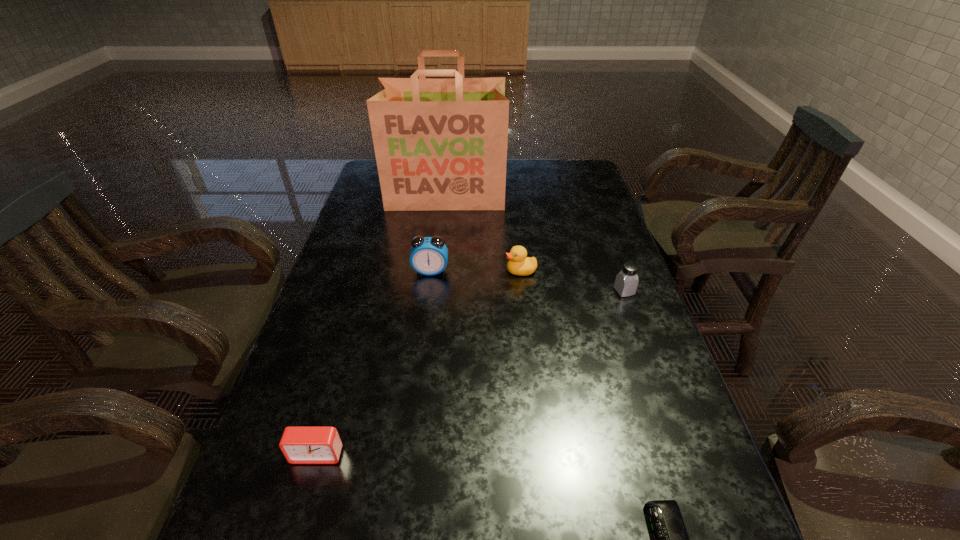
Find the location of a particular element. free point located 0.360m on the face of the fifth shortest object is located at coordinates (416, 385).

This screenshot has height=540, width=960. Find the location of `free location located on the back of the third nearest object`. free location located on the back of the third nearest object is located at coordinates (606, 239).

The image size is (960, 540). I want to click on vacant space located on the face of the duckling, so click(423, 271).

In order to click on free space located 0.270m on the face of the duckling in this screenshot , I will do `click(409, 271)`.

The height and width of the screenshot is (540, 960). Find the location of `vacant space located 0.370m on the face of the duckling`. vacant space located 0.370m on the face of the duckling is located at coordinates (373, 271).

At what (x,y) coordinates should I click in order to perform the action: click on object that is at the far edge. Please return your answer as a coordinate pair (x, y). Looking at the image, I should click on (440, 144).

The image size is (960, 540). What are the coordinates of `grocery bag that is at the left edge` in the screenshot? It's located at (440, 144).

You are a GUI agent. You are given a task and a screenshot of the screen. Output one action in this format:
    pyautogui.click(x=<x>, y=<y>)
    Task: Click on the alarm clock that is at the left edge
    
    Given the screenshot: What is the action you would take?
    pyautogui.click(x=300, y=445)

Locate an element on the screen. object located in the right edge section of the desktop is located at coordinates (626, 282).

At what (x,y) coordinates should I click in order to perform the action: click on object that is at the far left corner. Please return your answer as a coordinate pair (x, y). This screenshot has height=540, width=960. Looking at the image, I should click on (440, 144).